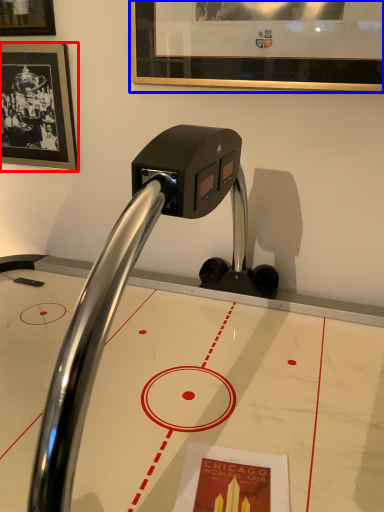
Question: Among these objects, which one is farthest to the camera, picture frame (highlighted by a red box) or picture frame (highlighted by a blue box)?

Choices:
 (A) picture frame
 (B) picture frame

Answer: (A)